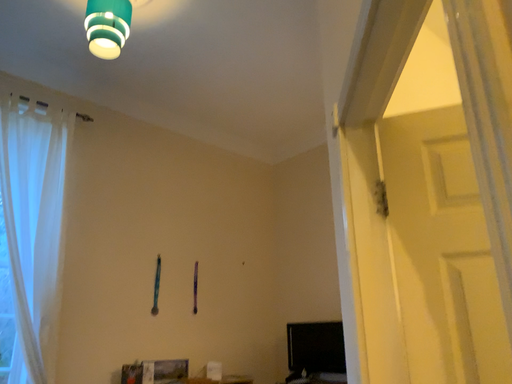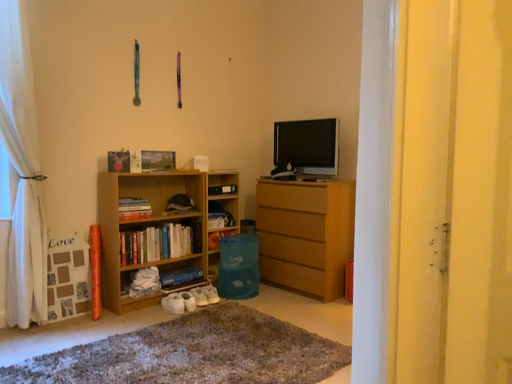
Question: Which way did the camera rotate in the video?

Choices:
 (A) rotated upward
 (B) rotated downward

Answer: (B)